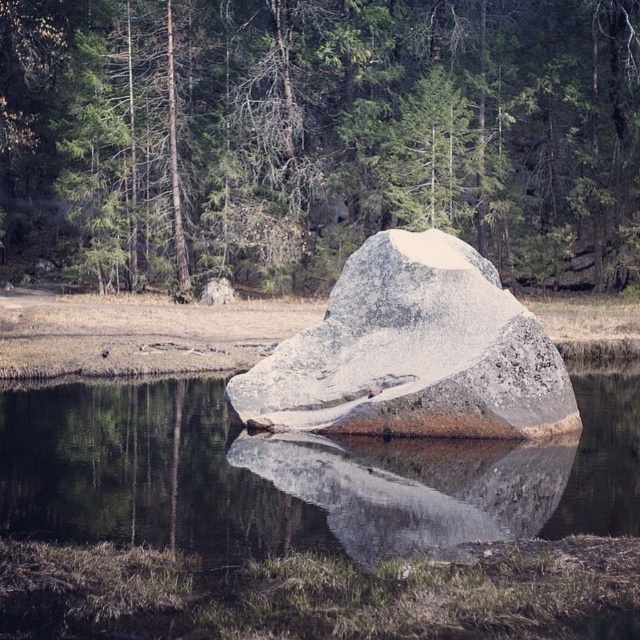
Does granite rock at center have a lesser width compared to smooth gray rock at center?

Incorrect, granite rock at center's width is not less than smooth gray rock at center's.

Can you confirm if granite rock at center is positioned below smooth gray rock at center?

Actually, granite rock at center is above smooth gray rock at center.

Which is behind, point (410, 330) or point (355, 468)?

Point (410, 330)

This screenshot has width=640, height=640. Find the location of `granite rock at center`. granite rock at center is located at coordinates (413, 353).

Does clear water at center appear on the right side of granite rock at center?

Incorrect, clear water at center is not on the right side of granite rock at center.

Consider the image. Between clear water at center and granite rock at center, which one appears on the right side from the viewer's perspective?

granite rock at center

Is point (177, 540) farther from camera compared to point (412, 324)?

No, (177, 540) is in front of (412, 324).

Locate an element on the screen. clear water at center is located at coordinates (294, 476).

Measure the distance between green textured rock at center and granite rock at center.

green textured rock at center and granite rock at center are 73.95 feet apart from each other.

Does green textured rock at center appear on the right side of granite rock at center?

In fact, green textured rock at center is to the left of granite rock at center.

The width and height of the screenshot is (640, 640). Identify the location of green textured rock at center. (316, 138).